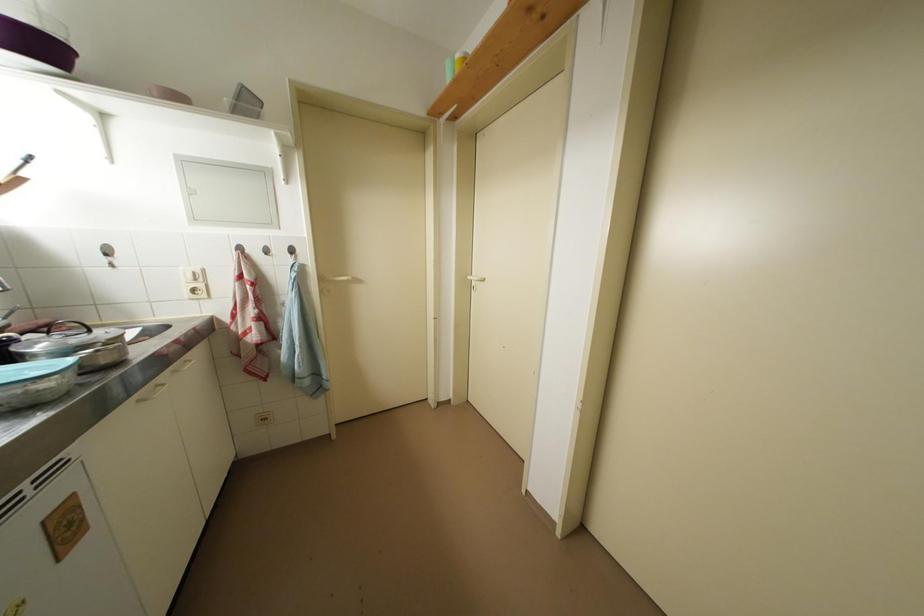
Where would you turn the panel latch? Please return your answer as a coordinate pair (x, y).

(193, 274)